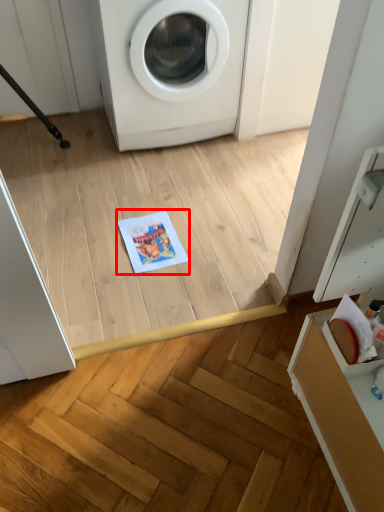
Question: Observing the image, what is the correct spatial positioning of copy (annotated by the red box) in reference to washing machine?

Choices:
 (A) left
 (B) right

Answer: (A)